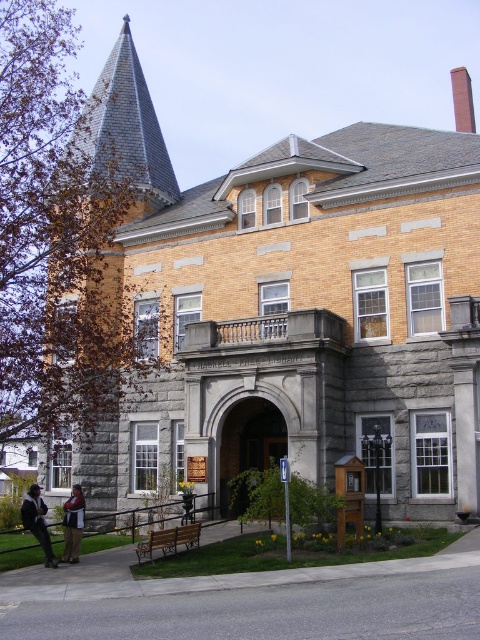
From the picture: You are standing at the entrance of the Haskell Free Library and want to locate the gray slate spire at upper left. According to the coordinates provided, where should you look to find it?

The gray slate spire at upper left is located at coordinates point (128, 124), which means you should look to the left side of the building near the top area.

You are standing at the entrance of the Haskell Free Library and want to take a photo of a specific point in the library. The point you need to focus on is located at coordinates point (83, 278). If your camera has a maximum focusing distance of 50 meters, will you be able to focus on that point?

The distance of point (83, 278) from camera is 48.93 meters, which is within the camera maximum focusing distance of 50 meters. So yes, you can focus on that point.